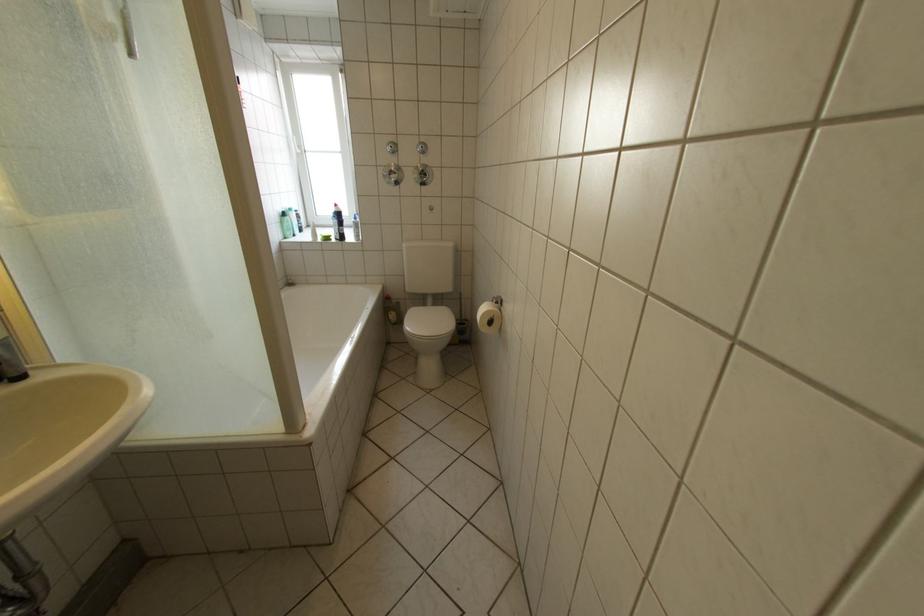
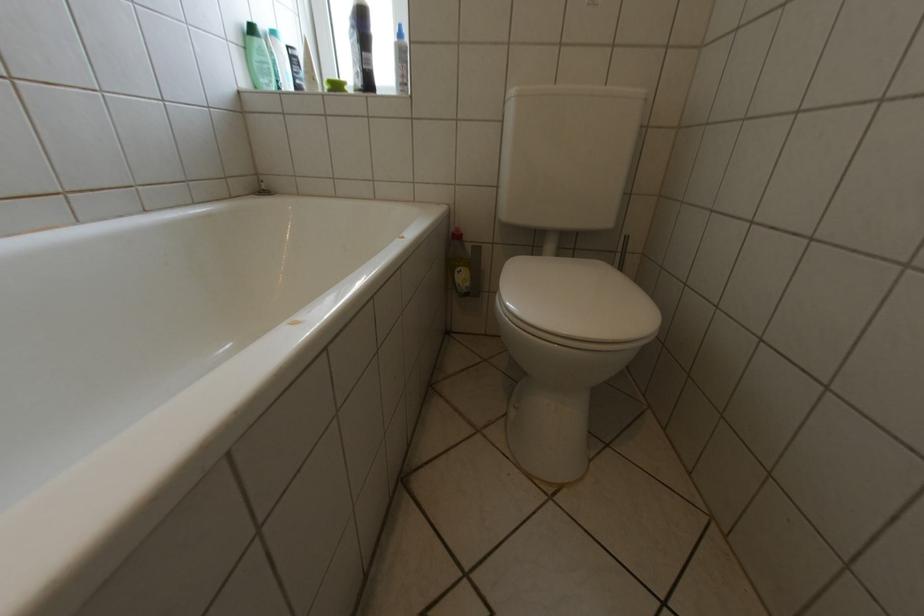
Locate, in the second image, the point that corresponds to pixel 403 314 in the first image.

(469, 270)